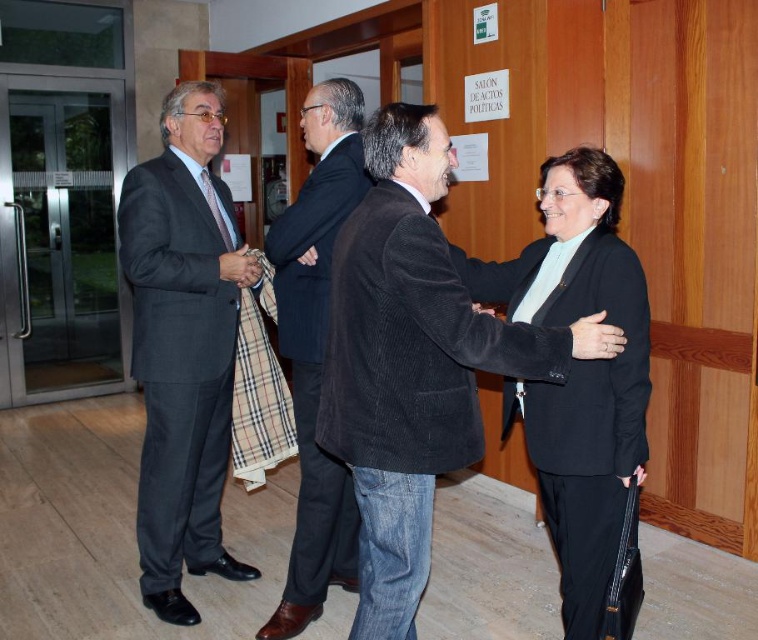
You are a photographer taking a picture of the scene. You notice two points marked in the image. Which point, point (443, 410) or point (614, 349), is closer to your camera?

Point (443, 410) is closer to the camera than point (614, 349).